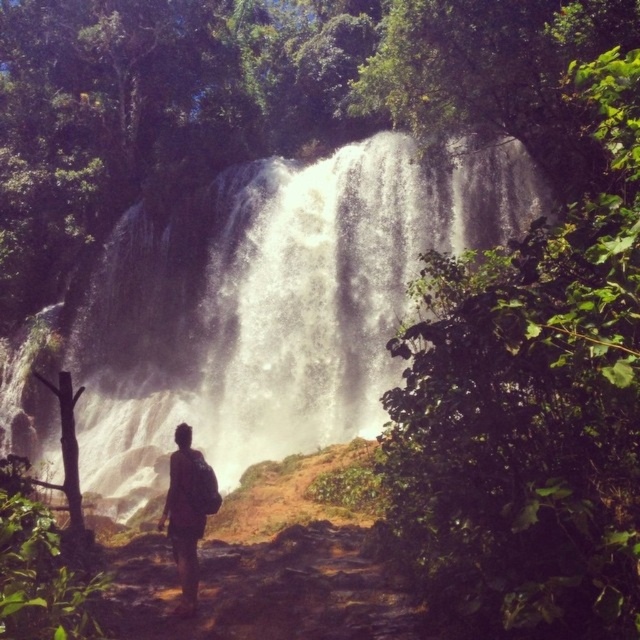
Is white frothy water at center taller than brown backpack at center?

Indeed, white frothy water at center has a greater height compared to brown backpack at center.

Can you confirm if white frothy water at center is positioned to the left of brown backpack at center?

Correct, you'll find white frothy water at center to the left of brown backpack at center.

Find the location of `white frothy water at center`. white frothy water at center is located at coordinates (272, 307).